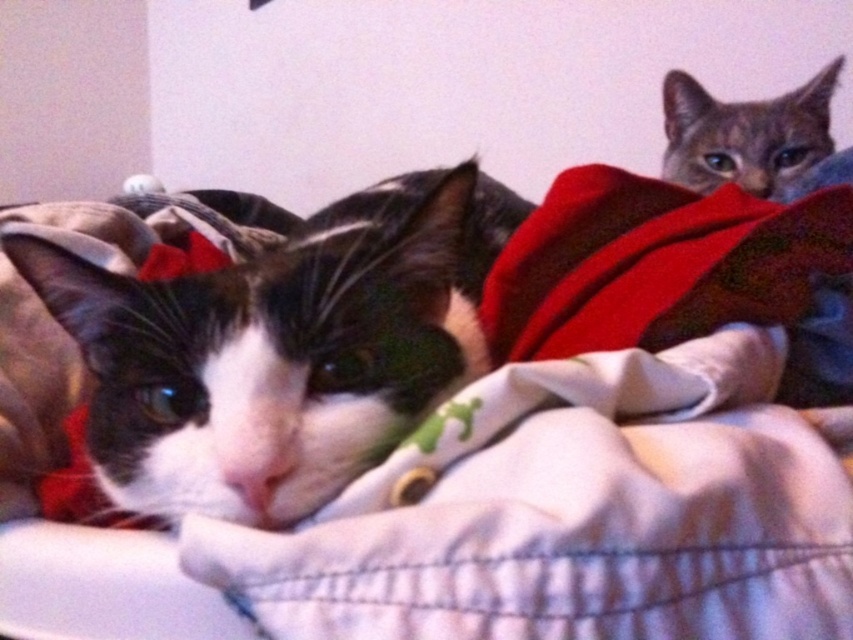
You are a photographer trying to capture both cats in a single shot. Given that the black and white fur cat at left is blocking part of the gray tabby cat at upper right, can you adjust your position to ensure both are fully visible without moving the cats?

The black and white fur cat at left is larger in size than the gray tabby cat at upper right, so adjusting your position to the side or slightly behind the larger cat might allow you to see around it and capture both cats fully in the frame.

You are a photographer trying to capture both cats in a photo. Given that the black and white fur cat at left is taller than the gray tabby cat at upper right, how might you position your camera to ensure both cats are fully visible in the frame?

Since the black and white fur cat at left is taller than the gray tabby cat at upper right, position the camera slightly above the black and white fur cat at left to ensure its full height is captured while still framing the gray tabby cat at upper right within the shot.

You are a photographer trying to capture both cats in a single frame. Given that the black and white fur cat at left is taking up more space than the gray tabby cat at upper right, which cat should you adjust your camera angle to focus on to ensure both are fully visible?

Since the black and white fur cat at left is wider than the gray tabby cat at upper right, you should adjust your camera angle to focus on the black and white fur cat at left first to ensure both cats fit within the frame.